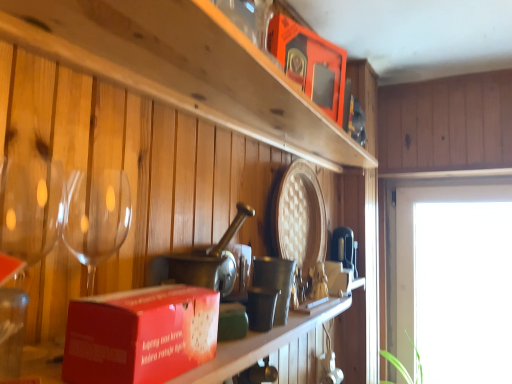
What do you see at coordinates (273, 348) in the screenshot? Image resolution: width=512 pixels, height=384 pixels. I see `matte red box at lower left` at bounding box center [273, 348].

I want to click on transparent glass window at right, so click(413, 236).

What do you see at coordinates (310, 63) in the screenshot?
I see `matte orange box at upper center, the 2th box ordered from the bottom` at bounding box center [310, 63].

Measure the distance between point (283, 141) and camera.

Point (283, 141) is 1.16 meters from camera.

Where is `wooden shelf at upper center`? Image resolution: width=512 pixels, height=384 pixels. wooden shelf at upper center is located at coordinates (184, 67).

Measure the distance between red cardboard box at center, acting as the 1th box starting from the front, and camera.

red cardboard box at center, acting as the 1th box starting from the front, and camera are 15.42 inches apart from each other.

This screenshot has width=512, height=384. Identify the location of matte red box at lower left. (273, 348).

Who is taller, metallic silver cup at center or matte red box at lower left?

Standing taller between the two is metallic silver cup at center.

Is metallic silver cup at center turned away from matte red box at lower left?

metallic silver cup at center is not turned away from matte red box at lower left.

How far apart are metallic silver cup at center and matte red box at lower left?

The distance of metallic silver cup at center from matte red box at lower left is 4.08 inches.

Is metallic silver cup at center located outside matte red box at lower left?

metallic silver cup at center lies outside matte red box at lower left's area.

Could you tell me if wooden shelf at upper center is turned towards matte red box at lower left?

No, wooden shelf at upper center is not turned towards matte red box at lower left.

I want to click on table on the left side of wooden shelf at upper center, so click(x=273, y=348).

Can you confirm if wooden shelf at upper center is thinner than matte red box at lower left?

Yes.

Is red cardboard box at center, arranged as the 2th box when viewed from the back, in contact with wooden shelf at upper center?

No.

Which object is closer to the camera, red cardboard box at center, the 2th box from the right, or wooden shelf at upper center?

red cardboard box at center, the 2th box from the right, is in front.

Considering the relative positions of red cardboard box at center, the 2th box from the right, and wooden shelf at upper center in the image provided, is red cardboard box at center, the 2th box from the right, to the left of wooden shelf at upper center from the viewer's perspective?

Correct, you'll find red cardboard box at center, the 2th box from the right, to the left of wooden shelf at upper center.

How many degrees apart are the facing directions of matte orange box at upper center, the second box when ordered from front to back, and transparent glass window at right?

matte orange box at upper center, the second box when ordered from front to back, and transparent glass window at right are facing 73.3 degrees away from each other.

Which of these two, matte orange box at upper center, which is the first box from back to front, or transparent glass window at right, is thinner?

With smaller width is transparent glass window at right.

Is matte orange box at upper center, the second box when ordered from left to right, bigger than transparent glass window at right?

Actually, matte orange box at upper center, the second box when ordered from left to right, might be smaller than transparent glass window at right.

Can we say transparent glass wine glass at left lies outside red cardboard box at center, the 2th box positioned from the top?

transparent glass wine glass at left lies outside red cardboard box at center, the 2th box positioned from the top,'s area.

The image size is (512, 384). What are the coordinates of `box below the transparent glass wine glass at left (from a real-world perspective)` in the screenshot? It's located at (140, 335).

Is transparent glass wine glass at left smaller than red cardboard box at center, which is counted as the first box, starting from the bottom?

Actually, transparent glass wine glass at left might be larger than red cardboard box at center, which is counted as the first box, starting from the bottom.

Is transparent glass wine glass at left far from red cardboard box at center, which is counted as the first box, starting from the bottom?

No, transparent glass wine glass at left is not far from red cardboard box at center, which is counted as the first box, starting from the bottom.

Consider the image. From the image's perspective, who appears lower, transparent glass window at right or matte red box at lower left?

transparent glass window at right is shown below in the image.

Looking at this image, which object is wider, transparent glass window at right or matte red box at lower left?

matte red box at lower left.

Is transparent glass window at right inside the boundaries of matte red box at lower left, or outside?

transparent glass window at right is not inside matte red box at lower left, it's outside.

Is metallic silver cup at center touching wooden shelf at upper center?

No, metallic silver cup at center is not touching wooden shelf at upper center.

Can you confirm if metallic silver cup at center is positioned to the left of wooden shelf at upper center?

Indeed, metallic silver cup at center is positioned on the left side of wooden shelf at upper center.

Is metallic silver cup at center positioned in front of wooden shelf at upper center?

That is False.

Where is `table on the right of metallic silver cup at center`? The width and height of the screenshot is (512, 384). table on the right of metallic silver cup at center is located at coordinates (273, 348).

You are a GUI agent. You are given a task and a screenshot of the screen. Output one action in this format:
    pyautogui.click(x=<x>, y=<y>)
    Task: Click on the table directly beneath the wooden shelf at upper center (from a real-world perspective)
    
    Given the screenshot: What is the action you would take?
    pyautogui.click(x=273, y=348)

Which object lies nearer to the anchor point matte orange box at upper center, placed as the 1th box when sorted from right to left, transparent glass wine glass at left or wooden shelf at upper center?

Based on the image, wooden shelf at upper center appears to be nearer to matte orange box at upper center, placed as the 1th box when sorted from right to left.

From the image, which object appears to be farther from wooden shelf at upper center, matte red box at lower left or metallic silver cup at center?

matte red box at lower left is further to wooden shelf at upper center.

Which object lies further to the anchor point matte orange box at upper center, the second box when ordered from front to back, transparent glass window at right or metallic silver cup at center?

Based on the image, transparent glass window at right appears to be further to matte orange box at upper center, the second box when ordered from front to back.

Consider the image. When comparing their distances from metallic silver cup at center, does matte red box at lower left or wooden shelf at upper center seem closer?

matte red box at lower left.

Looking at the image, which one is located further to matte orange box at upper center, the second box when ordered from front to back, matte red box at lower left or transparent glass wine glass at left?

transparent glass wine glass at left is further to matte orange box at upper center, the second box when ordered from front to back.

Considering their positions, is metallic silver cup at center positioned closer to transparent glass wine glass at left than wooden shelf at upper center?

wooden shelf at upper center is closer to transparent glass wine glass at left.

When comparing their distances from matte orange box at upper center, which is the first box in top-to-bottom order, does transparent glass window at right or matte red box at lower left seem closer?

matte red box at lower left.

Looking at the image, which one is located further to transparent glass wine glass at left, matte orange box at upper center, which is the first box from back to front, or metallic silver cup at center?

matte orange box at upper center, which is the first box from back to front, lies further to transparent glass wine glass at left than the other object.

Find the location of a particular element. shelf positioned between red cardboard box at center, which is counted as the first box, starting from the bottom, and matte orange box at upper center, placed as the 1th box when sorted from right to left, from near to far is located at coordinates (184, 67).

You are a GUI agent. You are given a task and a screenshot of the screen. Output one action in this format:
    pyautogui.click(x=<x>, y=<y>)
    Task: Click on the wine glass positioned between wooden shelf at upper center and transparent glass window at right from near to far
    The width and height of the screenshot is (512, 384).
    Given the screenshot: What is the action you would take?
    pyautogui.click(x=31, y=207)

Find the location of a particular element. The image size is (512, 384). box between transparent glass wine glass at left and transparent glass window at right from front to back is located at coordinates pos(310,63).

You are a GUI agent. You are given a task and a screenshot of the screen. Output one action in this format:
    pyautogui.click(x=<x>, y=<y>)
    Task: Click on the wine glass between matte orange box at upper center, the second box when ordered from front to back, and metallic silver cup at center in the up-down direction
    
    Given the screenshot: What is the action you would take?
    pyautogui.click(x=31, y=207)